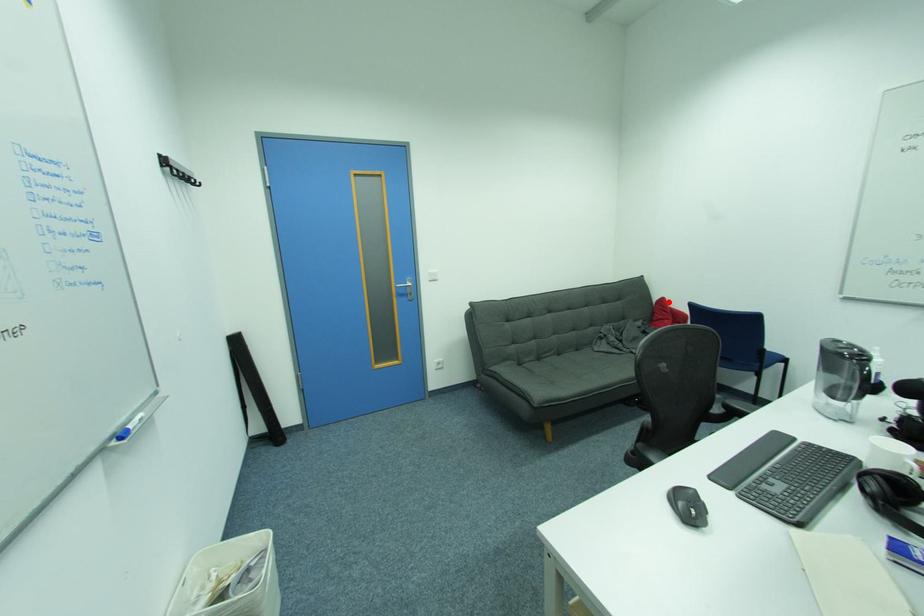
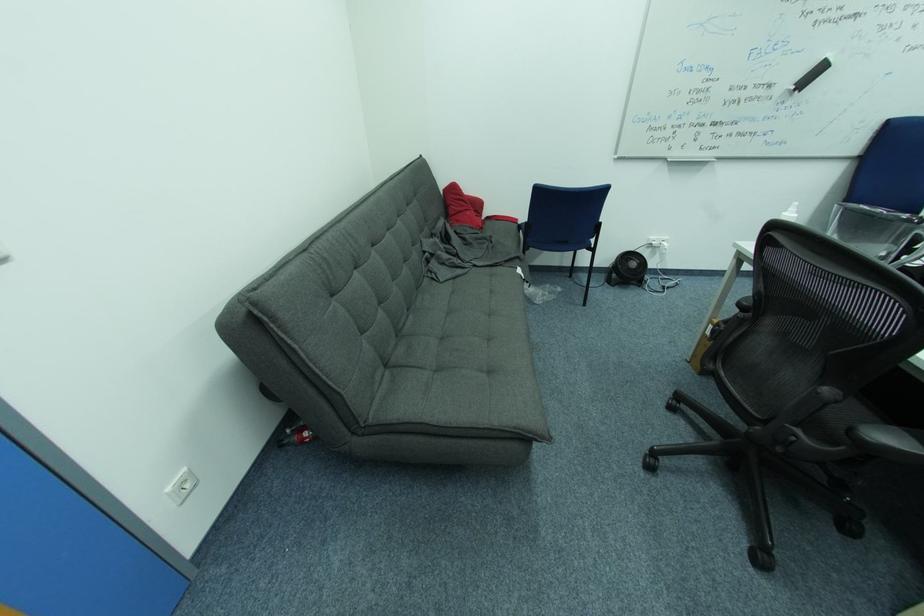
Find the pixel in the second image that matches the highlighted location in the first image.

(459, 188)